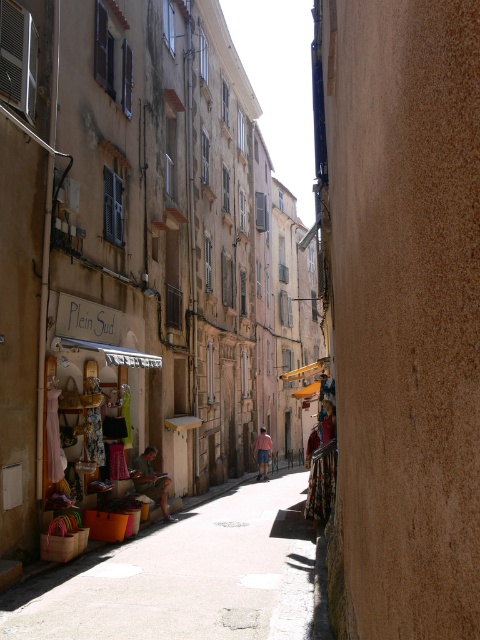
Does brown rough wall at right appear on the left side of wooden crates at lower left?

No, brown rough wall at right is not to the left of wooden crates at lower left.

Does brown rough wall at right lie behind wooden crates at lower left?

No, it is not.

Find the location of a particular element. brown rough wall at right is located at coordinates (400, 308).

This screenshot has width=480, height=640. In order to click on brown rough wall at right in this screenshot , I will do coord(400,308).

Can you confirm if matte brown building at center is smaller than light brown wooden chair at lower left?

Incorrect, matte brown building at center is not smaller in size than light brown wooden chair at lower left.

Is the position of matte brown building at center less distant than that of light brown wooden chair at lower left?

Yes.

Between point (166, 332) and point (154, 490), which one is positioned in front?

Point (154, 490) is more forward.

Where is `matte brown building at center`? matte brown building at center is located at coordinates (140, 252).

Which is above, light brown wooden chair at lower left or pink cotton shorts at center?

light brown wooden chair at lower left is above.

Between point (170, 520) and point (268, 438), which one is positioned in front?

Point (170, 520)

The image size is (480, 640). What are the coordinates of `light brown wooden chair at lower left` in the screenshot? It's located at pos(152,481).